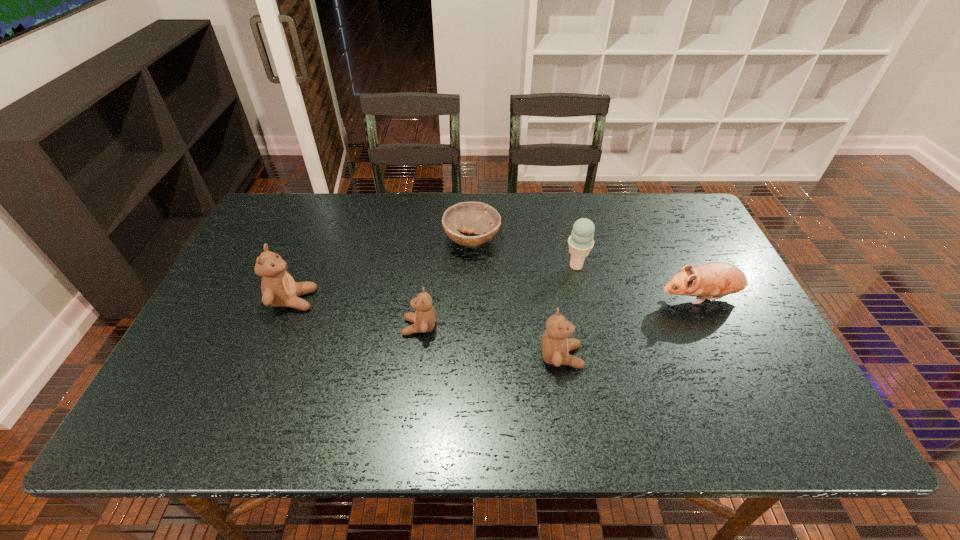
Locate an element on the screen. This screenshot has width=960, height=540. the leftmost teddy bear is located at coordinates (279, 289).

Identify the location of the second object from left to right. (424, 318).

The image size is (960, 540). In order to click on the second teddy bear from left to right in this screenshot , I will do `click(424, 318)`.

Where is `the second shortest teddy bear`? the second shortest teddy bear is located at coordinates (555, 346).

In order to click on the rightmost object in this screenshot , I will do `click(714, 280)`.

The image size is (960, 540). I want to click on the shortest object, so click(479, 218).

The image size is (960, 540). Identify the location of bowl. (479, 218).

This screenshot has width=960, height=540. In order to click on ice cream in this screenshot , I will do `click(580, 242)`.

Locate an element on the screen. Image resolution: width=960 pixels, height=540 pixels. vacant space located 0.250m on the front-facing side of the leftmost teddy bear is located at coordinates (409, 300).

Image resolution: width=960 pixels, height=540 pixels. In order to click on blank space located on the front-facing side of the second object from left to right in this screenshot , I will do `click(332, 327)`.